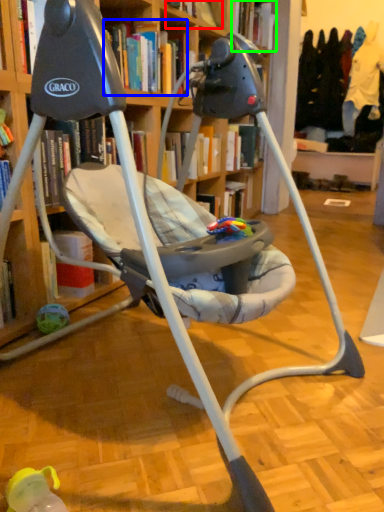
Question: Which object is positioned farthest from book (highlighted by a red box)? Select from book (highlighted by a blue box) and book (highlighted by a green box).

Choices:
 (A) book
 (B) book

Answer: (B)